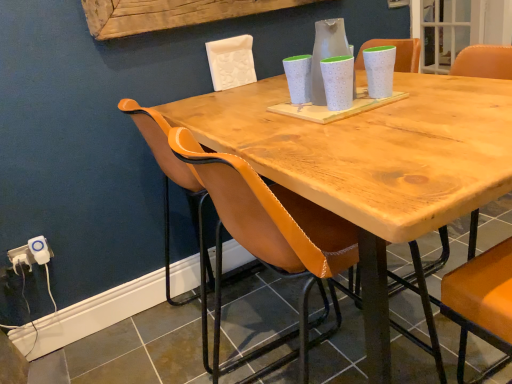
Question: Considering the relative sizes of white dotted vase at center and leather at left in the image provided, is white dotted vase at center bigger than leather at left?

Choices:
 (A) yes
 (B) no

Answer: (B)

Question: Is white dotted vase at center taller than leather at left?

Choices:
 (A) yes
 (B) no

Answer: (B)

Question: From the image's perspective, is white dotted vase at center on leather at left?

Choices:
 (A) no
 (B) yes

Answer: (B)

Question: Is white dotted vase at center in front of leather at left?

Choices:
 (A) no
 (B) yes

Answer: (A)

Question: Considering the relative sizes of white dotted vase at center and leather at left in the image provided, is white dotted vase at center wider than leather at left?

Choices:
 (A) no
 (B) yes

Answer: (A)

Question: Is white plastic electric outlet at lower left, which appears as the first electric outlet when viewed from the right, wider or thinner than white dotted vase at center?

Choices:
 (A) thin
 (B) wide

Answer: (A)

Question: Is white plastic electric outlet at lower left, which appears as the first electric outlet when viewed from the right, in front of or behind white dotted vase at center in the image?

Choices:
 (A) behind
 (B) front

Answer: (A)

Question: Considering the positions of white plastic electric outlet at lower left, which appears as the first electric outlet when viewed from the right, and white dotted vase at center in the image, is white plastic electric outlet at lower left, which appears as the first electric outlet when viewed from the right, taller or shorter than white dotted vase at center?

Choices:
 (A) short
 (B) tall

Answer: (A)

Question: From a real-world perspective, is white plastic electric outlet at lower left, which is counted as the 2th electric outlet, starting from the left, above or below white dotted vase at center?

Choices:
 (A) below
 (B) above

Answer: (A)

Question: Is white dotted vase at center wider or thinner than white plastic electric outlet at lower left, which appears as the first electric outlet when viewed from the right?

Choices:
 (A) wide
 (B) thin

Answer: (A)

Question: From the image's perspective, is white dotted vase at center above or below white plastic electric outlet at lower left, which appears as the first electric outlet when viewed from the right?

Choices:
 (A) below
 (B) above

Answer: (B)

Question: From a real-world perspective, relative to white plastic electric outlet at lower left, which is counted as the 2th electric outlet, starting from the left, is white dotted vase at center vertically above or below?

Choices:
 (A) below
 (B) above

Answer: (B)

Question: Considering the positions of white dotted vase at center and white plastic electric outlet at lower left, which appears as the first electric outlet when viewed from the right, in the image, is white dotted vase at center taller or shorter than white plastic electric outlet at lower left, which appears as the first electric outlet when viewed from the right,?

Choices:
 (A) tall
 (B) short

Answer: (A)

Question: Is leather at left taller or shorter than white plastic electric outlet at lower left, which is counted as the 2th electric outlet, starting from the left?

Choices:
 (A) short
 (B) tall

Answer: (B)

Question: From the image's perspective, is leather at left positioned above or below white plastic electric outlet at lower left, which is counted as the 2th electric outlet, starting from the left?

Choices:
 (A) below
 (B) above

Answer: (A)